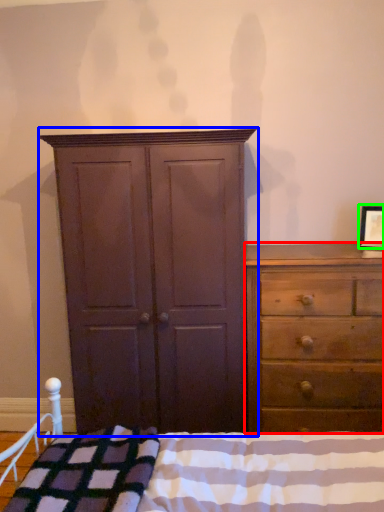
Question: Estimate the real-world distances between objects in this image. Which object is farther from chest of drawers (highlighted by a red box), cupboard (highlighted by a blue box) or picture frame (highlighted by a green box)?

Choices:
 (A) cupboard
 (B) picture frame

Answer: (B)